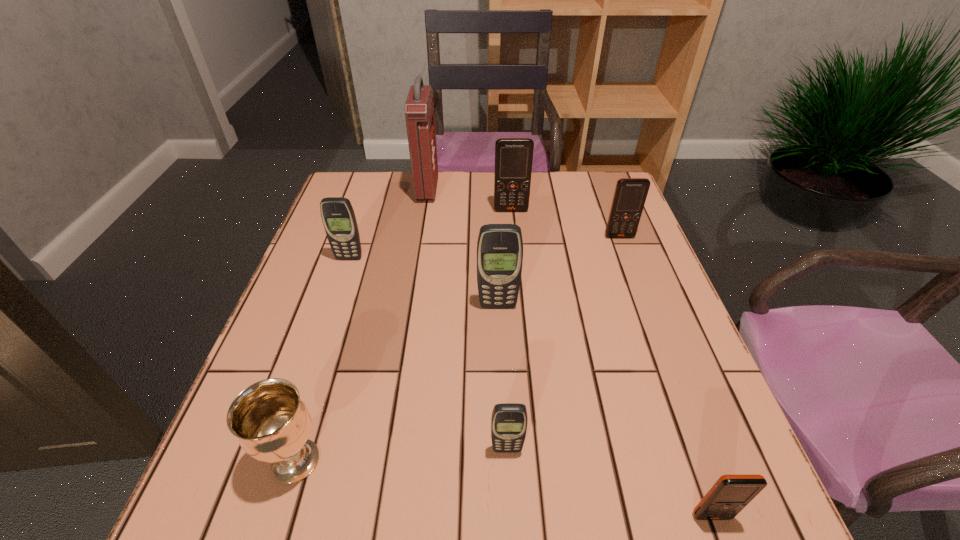
This screenshot has height=540, width=960. I want to click on the farthest object, so [x=419, y=109].

This screenshot has height=540, width=960. Find the location of `the first-aid kit`. the first-aid kit is located at coordinates (419, 109).

The height and width of the screenshot is (540, 960). I want to click on the seventh nearest object, so 513,156.

You are a GUI agent. You are given a task and a screenshot of the screen. Output one action in this format:
    pyautogui.click(x=<x>, y=<y>)
    Task: Click on the farthest cellular telephone
    The height and width of the screenshot is (540, 960).
    Given the screenshot: What is the action you would take?
    pyautogui.click(x=513, y=156)

Find the location of a particular element. This screenshot has width=960, height=540. the fourth farthest cellular telephone is located at coordinates click(500, 246).

Locate an element on the screen. The width and height of the screenshot is (960, 540). the fifth farthest object is located at coordinates (500, 246).

Locate an element on the screen. the leftmost gray cellular telephone is located at coordinates (338, 217).

This screenshot has height=540, width=960. In order to click on the third farthest cellular telephone in this screenshot , I will do `click(338, 217)`.

The height and width of the screenshot is (540, 960). Identify the location of the second farthest orange cellular telephone. (630, 194).

I want to click on the second farthest cellular telephone, so click(630, 194).